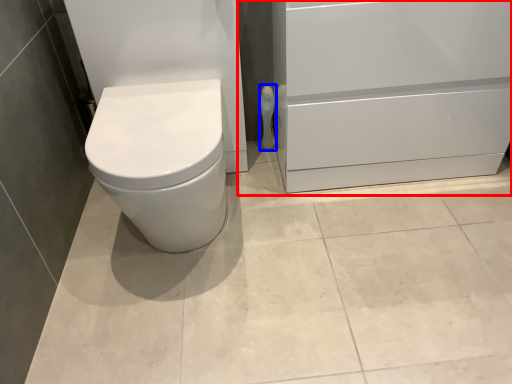
Question: Which object is closer to the camera taking this photo, file cabinet (highlighted by a red box) or toilet paper (highlighted by a blue box)?

Choices:
 (A) file cabinet
 (B) toilet paper

Answer: (A)